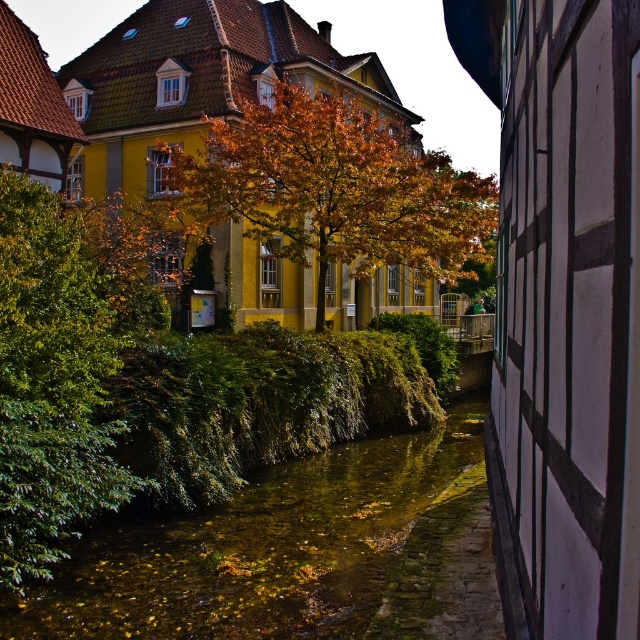
Between point (444, 472) and point (65, 392), which one is positioned in front?

Point (65, 392) is in front.

Is point (385, 564) closer to camera compared to point (16, 248)?

No, it is not.

The image size is (640, 640). I want to click on green mossy water at center, so click(x=298, y=554).

Can you confirm if autumn leaves at center is positioned above green leafy tree at left?

Correct, autumn leaves at center is located above green leafy tree at left.

Is autumn leaves at center further to the viewer compared to green leafy tree at left?

Yes.

Find the location of a particular element. autumn leaves at center is located at coordinates (336, 188).

Where is `autumn leaves at center`? autumn leaves at center is located at coordinates (336, 188).

Is point (371, 445) farther from camera compared to point (284, 193)?

That is True.

Which is behind, point (298, 506) or point (269, 131)?

The point (269, 131) is more distant.

You are a GUI agent. You are given a task and a screenshot of the screen. Output one action in this format:
    pyautogui.click(x=<x>, y=<y>)
    Task: Click on the green mossy water at center
    Image resolution: width=640 pixels, height=640 pixels.
    Given the screenshot: What is the action you would take?
    pyautogui.click(x=298, y=554)